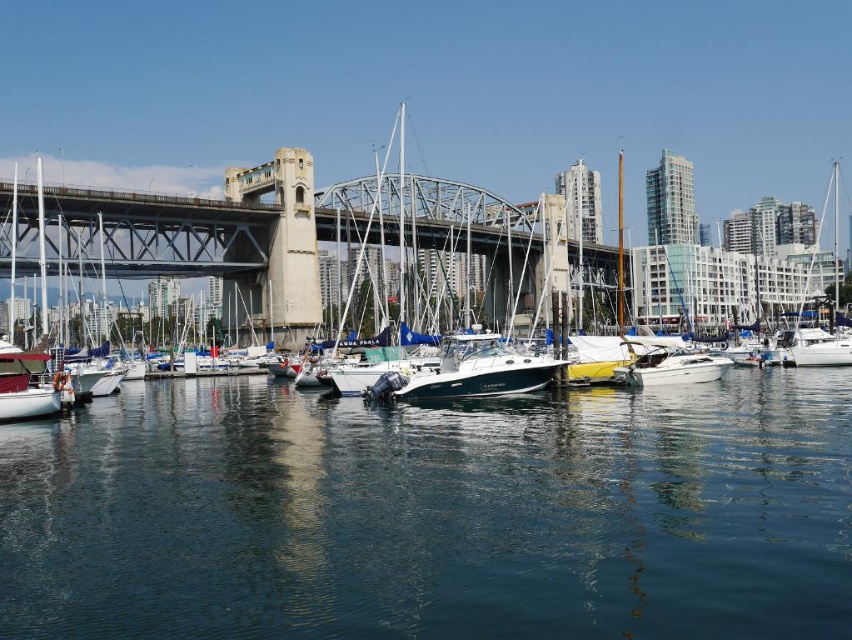
You are standing at the center of the suspension bridge and want to locate the shiny blue boat at center. According to the coordinates given, in which direction should you look relative to your position?

The shiny blue boat at center is located at coordinates point (478,371), which means it is slightly to the right and below your current position on the suspension bridge.

You are a photographer planning to capture a shot of the white matte sailboat at center and the white matte sailboat at lower left. Based on their heights, which boat should you position closer to the camera to ensure both appear equally tall in the photo?

The white matte sailboat at center is taller than the white matte sailboat at lower left. To make them appear equally tall in the photo, position the shorter white matte sailboat at lower left closer to the camera than the taller white matte sailboat at center.